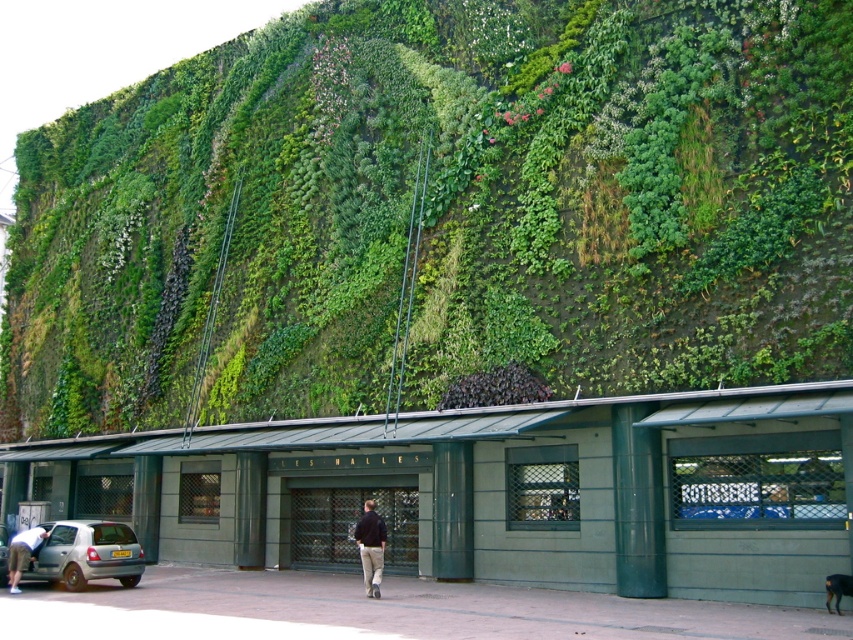
Question: Does green concrete shed at center appear under silver metallic hatchback at lower left?

Choices:
 (A) no
 (B) yes

Answer: (A)

Question: From the image, what is the correct spatial relationship of dark blue jacket at center in relation to light brown leather jacket at lower left?

Choices:
 (A) above
 (B) below

Answer: (A)

Question: Based on their relative distances, which object is nearer to the silver metallic car at lower left?

Choices:
 (A) silver metallic hatchback at lower left
 (B) light brown leather jacket at lower left
 (C) green concrete shed at center
 (D) dark blue jacket at center

Answer: (B)

Question: Which object is closer to the camera taking this photo?

Choices:
 (A) silver metallic car at lower left
 (B) green concrete shed at center
 (C) green leafy wall at upper center

Answer: (B)

Question: Observing the image, what is the correct spatial positioning of dark blue jacket at center in reference to light brown leather jacket at lower left?

Choices:
 (A) below
 (B) above

Answer: (B)

Question: Which is nearer to the green concrete shed at center?

Choices:
 (A) silver metallic car at lower left
 (B) silver metallic hatchback at lower left
 (C) light brown leather jacket at lower left
 (D) dark blue jacket at center

Answer: (B)